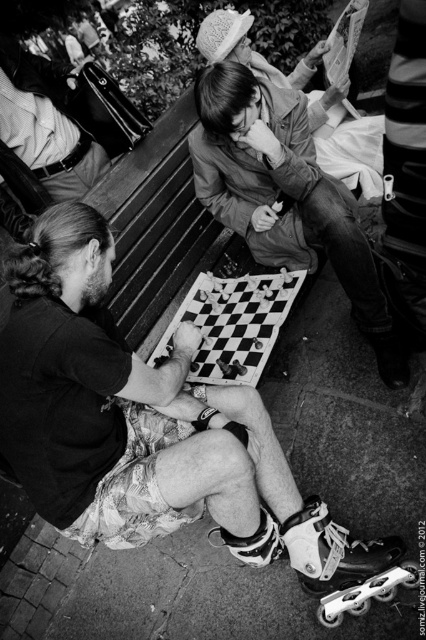
Question: Is the position of flannel shirt at center more distant than that of matte black chessboard at center?

Choices:
 (A) no
 (B) yes

Answer: (A)

Question: Considering the real-world distances, which object is closest to the checkerboard-patterned chessboard at center?

Choices:
 (A) flannel shirt at center
 (B) smooth leather jacket at upper left
 (C) matte black chessboard at center
 (D) white plastic roller skate at lower right

Answer: (A)

Question: Can you confirm if matte black chessboard at center is positioned to the right of smooth leather jacket at upper left?

Choices:
 (A) yes
 (B) no

Answer: (A)

Question: Does smooth leather jacket at upper left come behind white plastic roller skate at lower right?

Choices:
 (A) no
 (B) yes

Answer: (B)

Question: Which point appears closest to the camera in this image?

Choices:
 (A) (172, 483)
 (B) (227, 90)

Answer: (A)

Question: Which point is closer to the camera taking this photo?

Choices:
 (A) (181, 435)
 (B) (264, 298)
 (C) (39, 84)

Answer: (A)